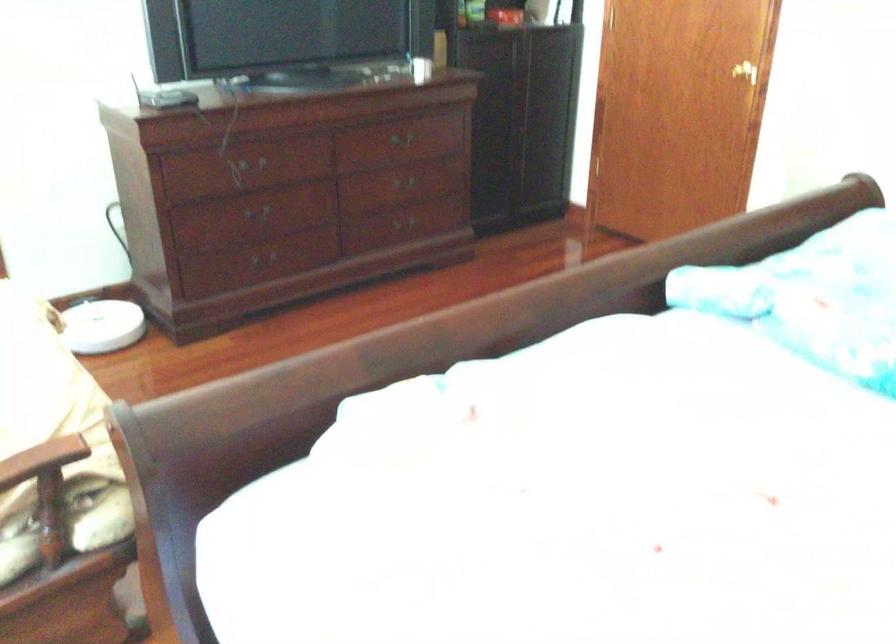
The height and width of the screenshot is (644, 896). I want to click on chair armrest, so click(44, 458).